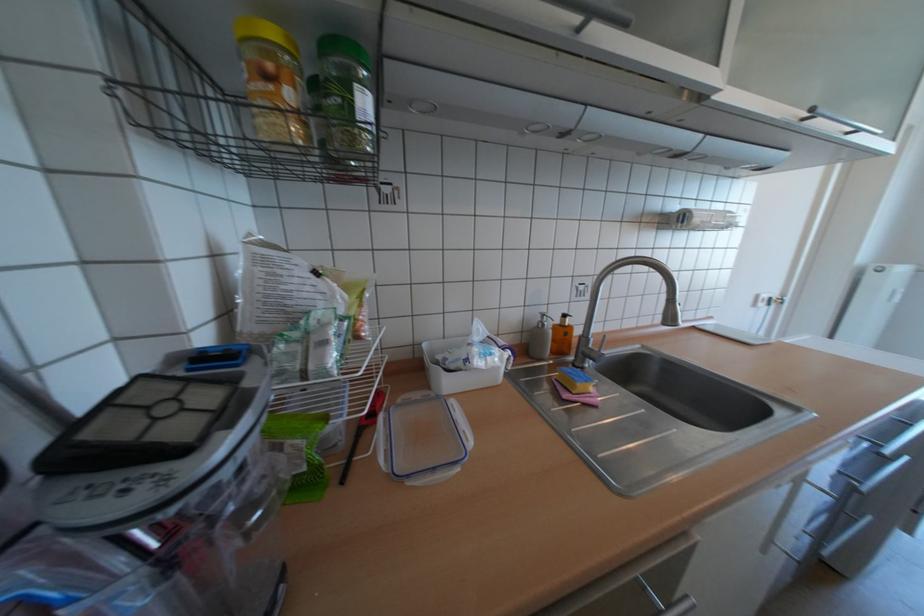
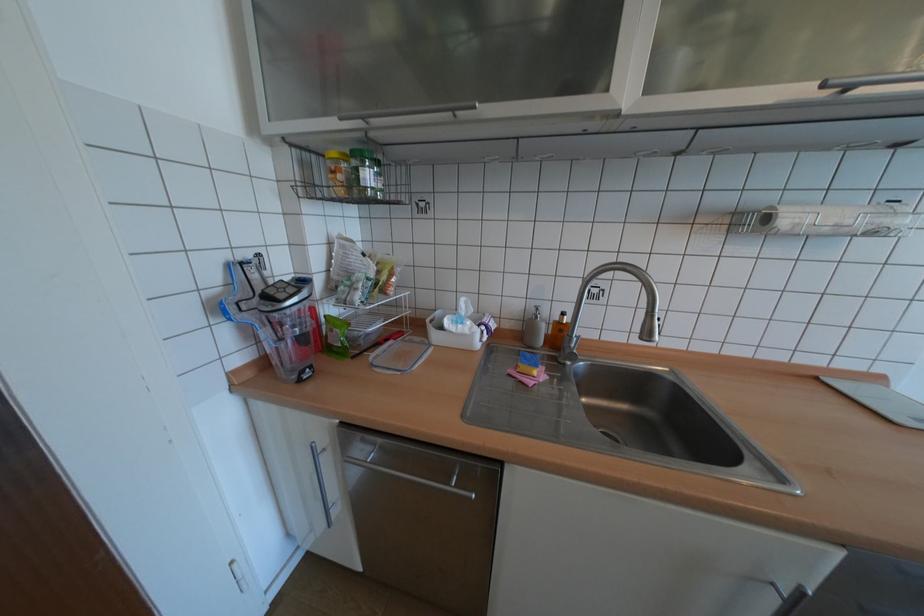
Locate, in the second image, the point that corresponds to (x=592, y=366) in the first image.

(574, 363)